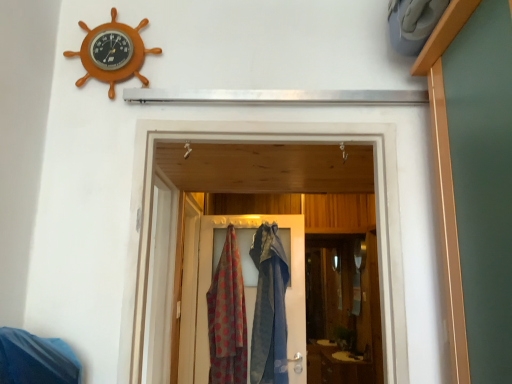
Question: Considering the relative sizes of orange wooden ship wheel at upper left and textured fabric door at center in the image provided, is orange wooden ship wheel at upper left shorter than textured fabric door at center?

Choices:
 (A) yes
 (B) no

Answer: (A)

Question: From the image's perspective, does orange wooden ship wheel at upper left appear higher than textured fabric door at center?

Choices:
 (A) yes
 (B) no

Answer: (A)

Question: Is textured fabric door at center at the back of orange wooden ship wheel at upper left?

Choices:
 (A) no
 (B) yes

Answer: (B)

Question: Considering the relative positions of orange wooden ship wheel at upper left and textured fabric door at center in the image provided, is orange wooden ship wheel at upper left to the right of textured fabric door at center from the viewer's perspective?

Choices:
 (A) no
 (B) yes

Answer: (A)

Question: Is orange wooden ship wheel at upper left aimed at textured fabric door at center?

Choices:
 (A) no
 (B) yes

Answer: (A)

Question: Does orange wooden ship wheel at upper left lie in front of textured fabric door at center?

Choices:
 (A) yes
 (B) no

Answer: (A)

Question: Is polka dot fabric scarf at center positioned far away from orange wooden ship wheel at upper left?

Choices:
 (A) yes
 (B) no

Answer: (A)

Question: Is polka dot fabric scarf at center positioned in front of orange wooden ship wheel at upper left?

Choices:
 (A) no
 (B) yes

Answer: (A)

Question: Is polka dot fabric scarf at center outside of orange wooden ship wheel at upper left?

Choices:
 (A) no
 (B) yes

Answer: (B)

Question: Is polka dot fabric scarf at center at the right side of orange wooden ship wheel at upper left?

Choices:
 (A) yes
 (B) no

Answer: (A)

Question: Can you confirm if polka dot fabric scarf at center is taller than orange wooden ship wheel at upper left?

Choices:
 (A) no
 (B) yes

Answer: (B)

Question: Is polka dot fabric scarf at center aimed at orange wooden ship wheel at upper left?

Choices:
 (A) no
 (B) yes

Answer: (B)

Question: Does textured fabric door at center have a larger size compared to polka dot fabric scarf at center?

Choices:
 (A) no
 (B) yes

Answer: (B)